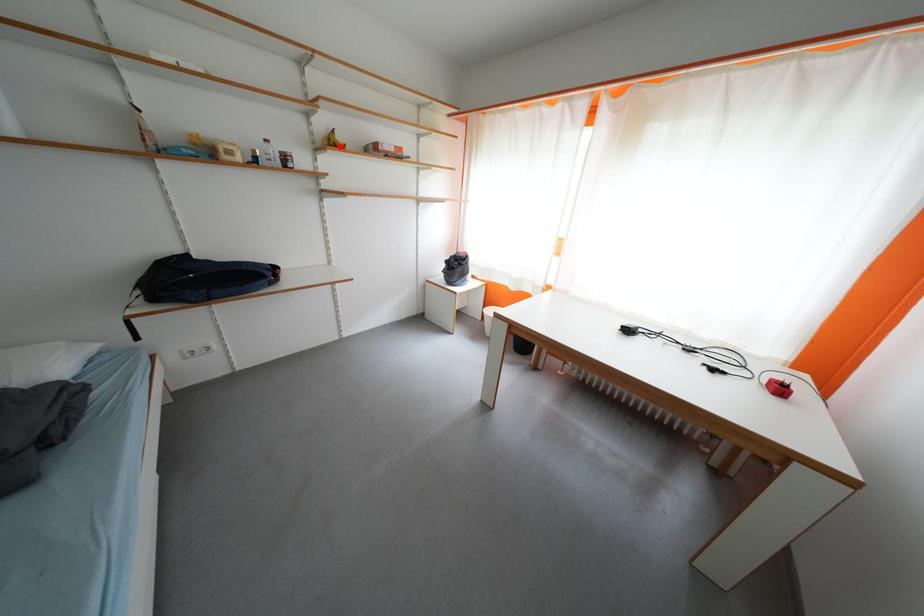
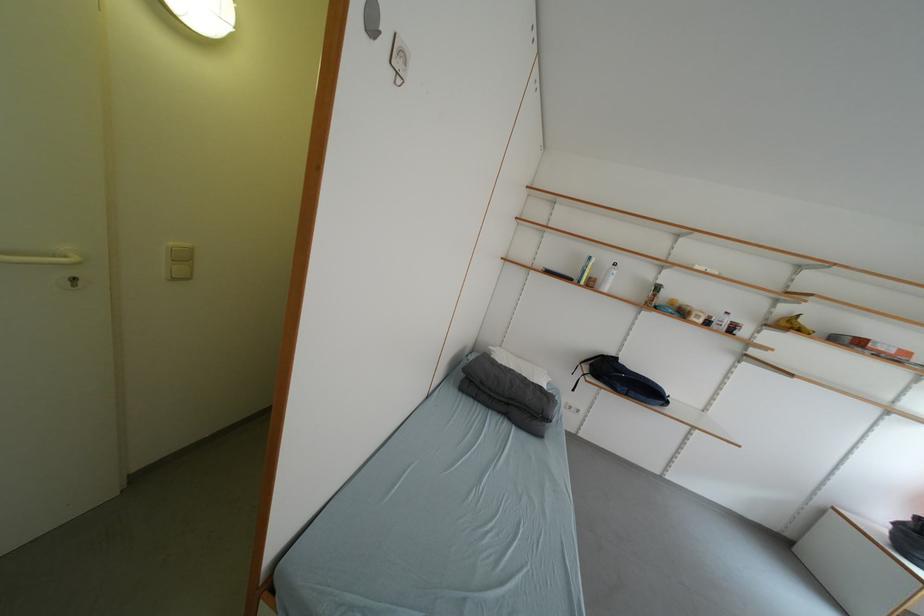
Where in the second image is the point corresponding to the highlighted location from the first image?

(797, 328)